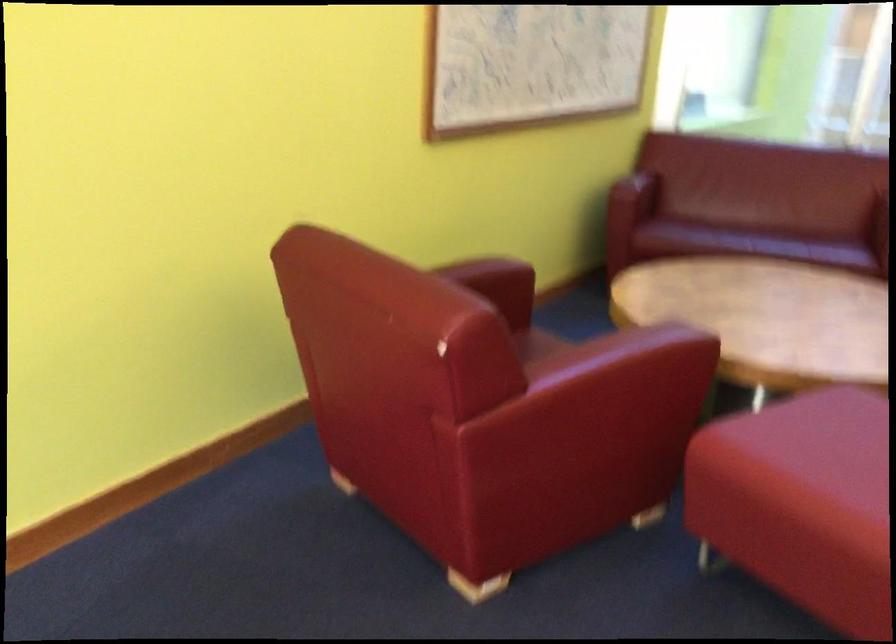
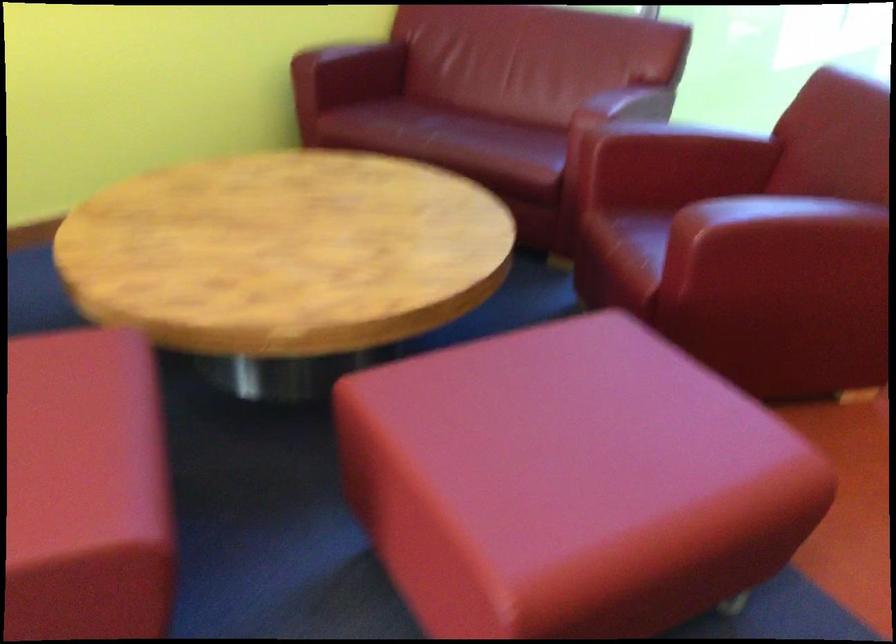
Which direction would the cameraman need to move to produce the second image?

The cameraman walked toward right, forward.